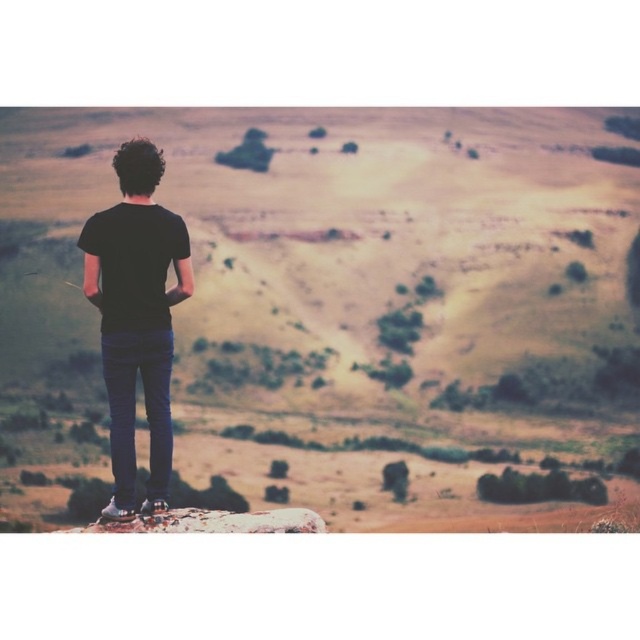
How far apart are desert sand at center and black matte t-shirt at center?

desert sand at center and black matte t-shirt at center are 21.87 meters apart.

Can you confirm if desert sand at center is smaller than black matte t-shirt at center?

Actually, desert sand at center might be larger than black matte t-shirt at center.

Who is more distant from viewer, (372, 115) or (124, 413)?

Positioned behind is point (372, 115).

This screenshot has height=640, width=640. I want to click on desert sand at center, so click(x=340, y=312).

Who is positioned more to the right, desert sand at center or smooth beige rock at center?

smooth beige rock at center is more to the right.

Who is more forward, [524,304] or [244,531]?

Point [244,531] is more forward.

Locate an element on the screen. The width and height of the screenshot is (640, 640). desert sand at center is located at coordinates (340, 312).

Which is above, black matte t-shirt at center or smooth beige rock at center?

black matte t-shirt at center is above.

Which of these two, black matte t-shirt at center or smooth beige rock at center, stands taller?

black matte t-shirt at center

The image size is (640, 640). What do you see at coordinates (136, 316) in the screenshot?
I see `black matte t-shirt at center` at bounding box center [136, 316].

I want to click on black matte t-shirt at center, so click(x=136, y=316).